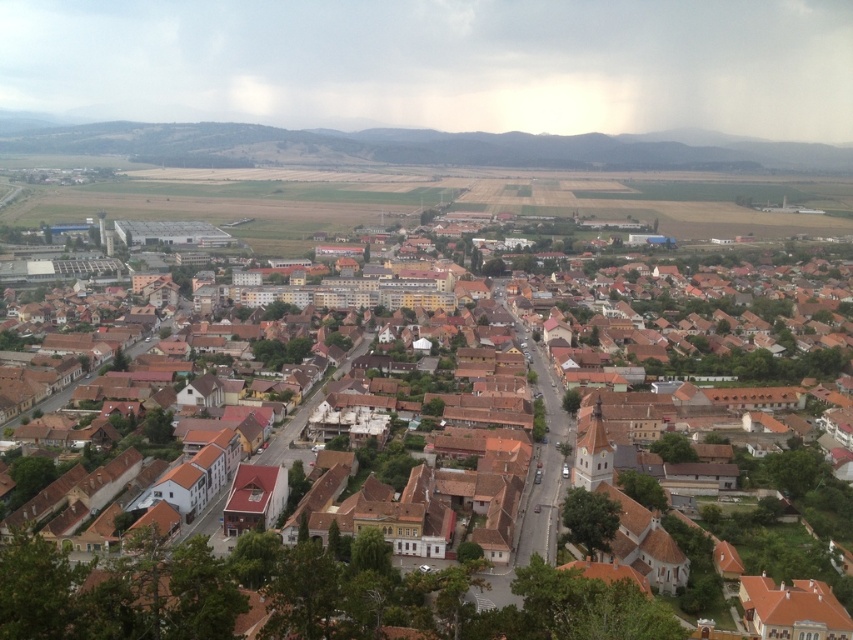
You are a drone operator flying over the town. You need to navigate between two points marked as point (376, 564) and point (550, 163). From your aerial view, which point is closer to the observer?

Point (376, 564) is in front of point (550, 163), so it is closer to the observer.

You are a drone operator planning to capture aerial footage of the town. The drone has a camera with a 10m wide field of view. If you position the drone to focus on the brown tiled roofs at center, will the green grassy hill at upper center also fit into the frame?

The brown tiled roofs at center has a lesser width compared to green grassy hill at upper center. Since the green grassy hill at upper center is wider, it would require a larger field of view to capture both together. The drone camera has a 10m wide field of view, so if focused on the brown tiled roofs at center, the green grassy hill at upper center may not fully fit into the frame unless adjusted.

You are a drone operator flying over the town. You need to determine which object is taller between the brown tiled roofs at center and the green grassy hill at upper center. Based on the scene, which one is taller?

The brown tiled roofs at center has a lesser height compared to green grassy hill at upper center, so the green grassy hill at upper center is taller.